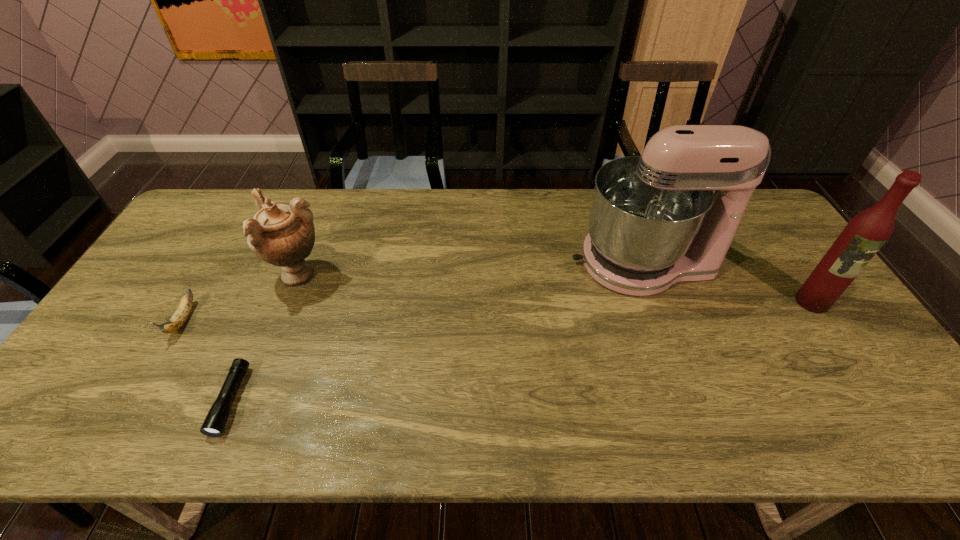
Image resolution: width=960 pixels, height=540 pixels. Identify the location of vacant space at the far right corner of the desktop. (765, 225).

Where is `free region at the near right corner`? Image resolution: width=960 pixels, height=540 pixels. free region at the near right corner is located at coordinates (872, 423).

Find the location of a particular element. The image size is (960, 540). free space that is in between the fourth tallest object and the rightmost object is located at coordinates (497, 311).

This screenshot has height=540, width=960. In order to click on free spot between the rightmost object and the third shortest object in this screenshot , I will do `click(555, 289)`.

Locate an element on the screen. vacant space in between the rightmost object and the fourth object from left to right is located at coordinates (728, 282).

In order to click on empty space that is in between the third shortest object and the leftmost object in this screenshot , I will do `click(241, 298)`.

You are a GUI agent. You are given a task and a screenshot of the screen. Output one action in this format:
    pyautogui.click(x=<x>, y=<y>)
    Task: Click on the vacant space that is in between the mixer and the shortest object
    The height and width of the screenshot is (540, 960).
    Given the screenshot: What is the action you would take?
    pyautogui.click(x=437, y=332)

Identify the location of free area in between the liquor and the mixer. The width and height of the screenshot is (960, 540). (728, 282).

Identify the location of free spot between the flashlight and the fourth tallest object. (207, 360).

Find the location of a particular element. The image size is (960, 540). vacant point located between the third tallest object and the shortest object is located at coordinates (265, 339).